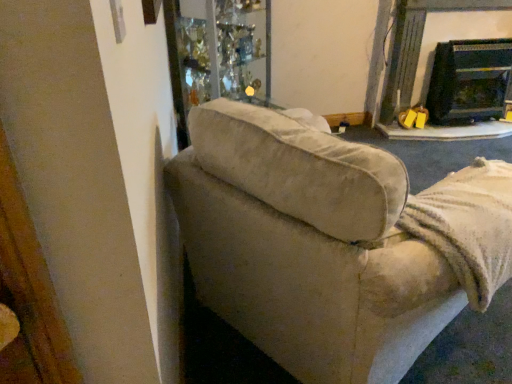
Describe the element at coordinates (468, 81) in the screenshot. I see `black glass fireplace at upper right, placed as the first fireplace when sorted from right to left` at that location.

What is the approximate height of beige fabric couch at left?

37.78 inches.

Describe the element at coordinates (322, 245) in the screenshot. I see `beige fabric couch at left` at that location.

Where is `black glossy fireplace at upper right, which ranks as the second fireplace in right-to-left order`? Image resolution: width=512 pixels, height=384 pixels. black glossy fireplace at upper right, which ranks as the second fireplace in right-to-left order is located at coordinates (433, 56).

From a real-world perspective, which fireplace is the 1st one underneath the transparent glass cabinet at upper center? Please provide its 2D coordinates.

[(433, 56)]

How far apart are transparent glass cabinet at upper center and black glossy fireplace at upper right, which ranks as the second fireplace in right-to-left order?

transparent glass cabinet at upper center is 4.63 feet away from black glossy fireplace at upper right, which ranks as the second fireplace in right-to-left order.

Is point (247, 59) closer or farther from the camera than point (451, 13)?

Point (247, 59) is positioned closer to the camera compared to point (451, 13).

Considering the relative sizes of transparent glass cabinet at upper center and black glossy fireplace at upper right, the first fireplace from the left, in the image provided, is transparent glass cabinet at upper center taller than black glossy fireplace at upper right, the first fireplace from the left,?

Indeed, transparent glass cabinet at upper center has a greater height compared to black glossy fireplace at upper right, the first fireplace from the left.

From a real-world perspective, which object stands above the other?

black glossy fireplace at upper right, the first fireplace from the left, is physically above.

From the image's perspective, is black glossy fireplace at upper right, which ranks as the second fireplace in right-to-left order, positioned above or below black glass fireplace at upper right, placed as the first fireplace when sorted from right to left?

black glossy fireplace at upper right, which ranks as the second fireplace in right-to-left order, is situated higher than black glass fireplace at upper right, placed as the first fireplace when sorted from right to left, in the image.

Considering their positions, is black glossy fireplace at upper right, the first fireplace from the left, located in front of or behind black glass fireplace at upper right, placed as the second fireplace when sorted from left to right?

Visually, black glossy fireplace at upper right, the first fireplace from the left, is located in front of black glass fireplace at upper right, placed as the second fireplace when sorted from left to right.

Between point (423, 88) and point (485, 55), which one is positioned behind?

Positioned behind is point (423, 88).

Which is in front, transparent glass cabinet at upper center or beige fabric couch at left?

Positioned in front is beige fabric couch at left.

Does point (245, 8) come in front of point (221, 131)?

No, it is not.

Based on the photo, from the image's perspective, is transparent glass cabinet at upper center located above beige fabric couch at left?

Correct, transparent glass cabinet at upper center appears higher than beige fabric couch at left in the image.

Is transparent glass cabinet at upper center turned away from beige fabric couch at left?

No, transparent glass cabinet at upper center is not facing away from beige fabric couch at left.

Are beige fabric couch at left and black glass fireplace at upper right, placed as the first fireplace when sorted from right to left, making contact?

beige fabric couch at left and black glass fireplace at upper right, placed as the first fireplace when sorted from right to left, are clearly separated.

Between point (387, 264) and point (469, 40), which one is positioned behind?

The point (469, 40) is farther from the camera.

Is black glossy fireplace at upper right, the first fireplace from the left, next to transparent glass cabinet at upper center?

No, black glossy fireplace at upper right, the first fireplace from the left, is not with transparent glass cabinet at upper center.

From the picture: Would you say black glossy fireplace at upper right, the first fireplace from the left, contains transparent glass cabinet at upper center?

No, transparent glass cabinet at upper center is not surrounded by black glossy fireplace at upper right, the first fireplace from the left.

Is black glossy fireplace at upper right, which ranks as the second fireplace in right-to-left order, facing away from transparent glass cabinet at upper center?

No, transparent glass cabinet at upper center is not at the back of black glossy fireplace at upper right, which ranks as the second fireplace in right-to-left order.

Can you confirm if black glossy fireplace at upper right, which ranks as the second fireplace in right-to-left order, is taller than transparent glass cabinet at upper center?

In fact, black glossy fireplace at upper right, which ranks as the second fireplace in right-to-left order, may be shorter than transparent glass cabinet at upper center.

From a real-world perspective, which is physically below, beige fabric couch at left or black glossy fireplace at upper right, which ranks as the second fireplace in right-to-left order?

In real-world perspective, beige fabric couch at left is lower.

Are beige fabric couch at left and black glossy fireplace at upper right, the first fireplace from the left, beside each other?

No, beige fabric couch at left is not touching black glossy fireplace at upper right, the first fireplace from the left.

Is beige fabric couch at left looking in the opposite direction of black glossy fireplace at upper right, which ranks as the second fireplace in right-to-left order?

No, beige fabric couch at left is not facing away from black glossy fireplace at upper right, which ranks as the second fireplace in right-to-left order.

From a real-world perspective, is black glass fireplace at upper right, placed as the first fireplace when sorted from right to left, beneath beige fabric couch at left?

Yes, from a real-world perspective, black glass fireplace at upper right, placed as the first fireplace when sorted from right to left, is beneath beige fabric couch at left.

Is black glass fireplace at upper right, placed as the second fireplace when sorted from left to right, thinner than beige fabric couch at left?

Correct, the width of black glass fireplace at upper right, placed as the second fireplace when sorted from left to right, is less than that of beige fabric couch at left.

Is black glass fireplace at upper right, placed as the second fireplace when sorted from left to right, shorter than beige fabric couch at left?

Yes.

From the image's perspective, does black glass fireplace at upper right, placed as the second fireplace when sorted from left to right, appear lower than beige fabric couch at left?

No, from the image's perspective, black glass fireplace at upper right, placed as the second fireplace when sorted from left to right, is not below beige fabric couch at left.

Locate an element on the screen. glass door above the black glossy fireplace at upper right, the first fireplace from the left (from a real-world perspective) is located at coordinates 217,53.

This screenshot has height=384, width=512. I want to click on fireplace that is below the black glossy fireplace at upper right, the first fireplace from the left (from the image's perspective), so click(468, 81).

Looking at the image, which one is located further to black glass fireplace at upper right, placed as the first fireplace when sorted from right to left, black glossy fireplace at upper right, which ranks as the second fireplace in right-to-left order, or transparent glass cabinet at upper center?

transparent glass cabinet at upper center is positioned further to the anchor black glass fireplace at upper right, placed as the first fireplace when sorted from right to left.

Looking at the image, which one is located closer to black glass fireplace at upper right, placed as the first fireplace when sorted from right to left, beige fabric couch at left or black glossy fireplace at upper right, the first fireplace from the left?

Based on the image, black glossy fireplace at upper right, the first fireplace from the left, appears to be nearer to black glass fireplace at upper right, placed as the first fireplace when sorted from right to left.

Estimate the real-world distances between objects in this image. Which object is closer to black glass fireplace at upper right, placed as the second fireplace when sorted from left to right, transparent glass cabinet at upper center or black glossy fireplace at upper right, which ranks as the second fireplace in right-to-left order?

Based on the image, black glossy fireplace at upper right, which ranks as the second fireplace in right-to-left order, appears to be nearer to black glass fireplace at upper right, placed as the second fireplace when sorted from left to right.

Based on their spatial positions, is black glass fireplace at upper right, placed as the second fireplace when sorted from left to right, or beige fabric couch at left closer to black glossy fireplace at upper right, which ranks as the second fireplace in right-to-left order?

black glass fireplace at upper right, placed as the second fireplace when sorted from left to right, is closer to black glossy fireplace at upper right, which ranks as the second fireplace in right-to-left order.

Considering their positions, is beige fabric couch at left positioned further to transparent glass cabinet at upper center than black glossy fireplace at upper right, which ranks as the second fireplace in right-to-left order?

Based on the image, beige fabric couch at left appears to be further to transparent glass cabinet at upper center.

Based on the photo, looking at the image, which one is located further to beige fabric couch at left, black glass fireplace at upper right, placed as the second fireplace when sorted from left to right, or black glossy fireplace at upper right, the first fireplace from the left?

The object further to beige fabric couch at left is black glass fireplace at upper right, placed as the second fireplace when sorted from left to right.

Based on their spatial positions, is black glossy fireplace at upper right, the first fireplace from the left, or transparent glass cabinet at upper center further from beige fabric couch at left?

Based on the image, black glossy fireplace at upper right, the first fireplace from the left, appears to be further to beige fabric couch at left.

From the image, which object appears to be nearer to black glass fireplace at upper right, placed as the second fireplace when sorted from left to right, transparent glass cabinet at upper center or beige fabric couch at left?

Among the two, transparent glass cabinet at upper center is located nearer to black glass fireplace at upper right, placed as the second fireplace when sorted from left to right.

Identify the location of glass door between beige fabric couch at left and black glass fireplace at upper right, placed as the second fireplace when sorted from left to right, along the z-axis. Image resolution: width=512 pixels, height=384 pixels. (217, 53).

The width and height of the screenshot is (512, 384). I want to click on glass door between beige fabric couch at left and black glossy fireplace at upper right, which ranks as the second fireplace in right-to-left order, along the z-axis, so click(217, 53).

Identify the location of fireplace between transparent glass cabinet at upper center and black glass fireplace at upper right, placed as the first fireplace when sorted from right to left, in the horizontal direction. This screenshot has height=384, width=512. pyautogui.click(x=433, y=56).

The image size is (512, 384). In order to click on fireplace between beige fabric couch at left and black glass fireplace at upper right, placed as the second fireplace when sorted from left to right, from front to back in this screenshot , I will do `click(433, 56)`.